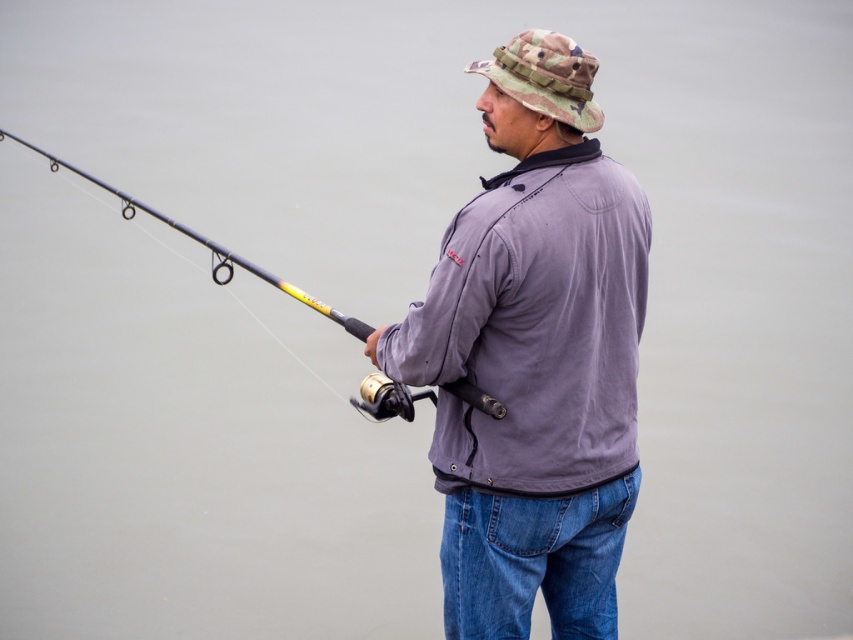
Does purple matte jacket at center have a lesser width compared to yellow and black fishing rod at left?

Yes, purple matte jacket at center is thinner than yellow and black fishing rod at left.

Between purple matte jacket at center and yellow and black fishing rod at left, which one is positioned higher?

yellow and black fishing rod at left is higher up.

Does point (552, 141) come behind point (27, 144)?

No, it is in front of (27, 144).

The width and height of the screenshot is (853, 640). What are the coordinates of `purple matte jacket at center` in the screenshot? It's located at (534, 356).

Who is lower down, camo fabric hat at upper center or yellow and black fishing rod at left?

Positioned lower is yellow and black fishing rod at left.

In the scene shown: Can you confirm if camo fabric hat at upper center is positioned below yellow and black fishing rod at left?

No, camo fabric hat at upper center is not below yellow and black fishing rod at left.

Identify the location of camo fabric hat at upper center. (544, 76).

You are a GUI agent. You are given a task and a screenshot of the screen. Output one action in this format:
    pyautogui.click(x=<x>, y=<y>)
    Task: Click on the camo fabric hat at upper center
    
    Given the screenshot: What is the action you would take?
    pyautogui.click(x=544, y=76)

Between purple matte jacket at center and camo fabric hat at upper center, which one is positioned lower?

Positioned lower is purple matte jacket at center.

Between point (558, 358) and point (527, 88), which one is positioned in front?

Point (527, 88)

Locate an element on the screen. purple matte jacket at center is located at coordinates (534, 356).